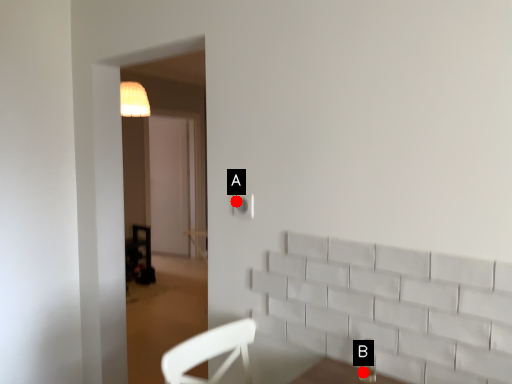
Question: Two points are circled on the image, labeled by A and B beside each circle. Which point is closer to the camera?

Choices:
 (A) A is closer
 (B) B is closer

Answer: (B)